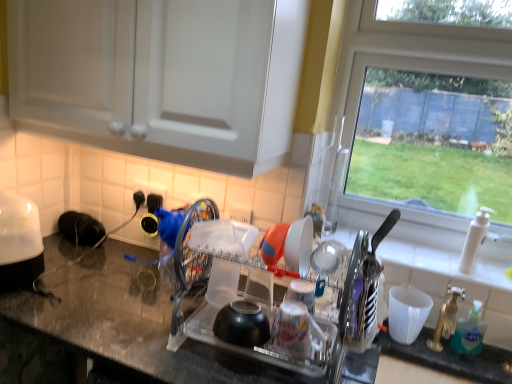
Question: From the image's perspective, is white plastic cup at right, the first tableware from the bottom, over blue translucent soap dispenser at right?

Choices:
 (A) yes
 (B) no

Answer: (A)

Question: Would you consider white plastic cup at right, which appears as the second tableware when viewed from the front, to be distant from blue translucent soap dispenser at right?

Choices:
 (A) yes
 (B) no

Answer: (B)

Question: Is white plastic cup at right, which is counted as the 2th tableware, starting from the left, placed right next to blue translucent soap dispenser at right?

Choices:
 (A) yes
 (B) no

Answer: (B)

Question: Does white plastic cup at right, the first tableware from the bottom, have a lesser width compared to blue translucent soap dispenser at right?

Choices:
 (A) no
 (B) yes

Answer: (A)

Question: From a real-world perspective, is white plastic cup at right, which appears as the second tableware when viewed from the front, positioned over blue translucent soap dispenser at right based on gravity?

Choices:
 (A) no
 (B) yes

Answer: (A)

Question: Is white glossy toaster at left bigger or smaller than white plastic faucet at right?

Choices:
 (A) small
 (B) big

Answer: (B)

Question: Looking at their shapes, would you say white glossy toaster at left is wider or thinner than white plastic faucet at right?

Choices:
 (A) wide
 (B) thin

Answer: (A)

Question: From the image's perspective, is white glossy toaster at left above or below white plastic faucet at right?

Choices:
 (A) above
 (B) below

Answer: (A)

Question: Is white glossy toaster at left taller or shorter than white plastic faucet at right?

Choices:
 (A) short
 (B) tall

Answer: (B)

Question: Based on their positions, is blue translucent soap dispenser at right located to the left or right of transparent glass window at upper right?

Choices:
 (A) left
 (B) right

Answer: (B)

Question: From the image's perspective, is blue translucent soap dispenser at right positioned above or below transparent glass window at upper right?

Choices:
 (A) above
 (B) below

Answer: (B)

Question: Is point (480, 307) closer or farther from the camera than point (467, 221)?

Choices:
 (A) farther
 (B) closer

Answer: (B)

Question: Is blue translucent soap dispenser at right inside the boundaries of transparent glass window at upper right, or outside?

Choices:
 (A) outside
 (B) inside

Answer: (A)

Question: Is point (479, 342) positioned closer to the camera than point (420, 327)?

Choices:
 (A) closer
 (B) farther

Answer: (A)

Question: Is blue translucent soap dispenser at right wider or thinner than white plastic cup at right, which is the 1th tableware in right-to-left order?

Choices:
 (A) wide
 (B) thin

Answer: (B)